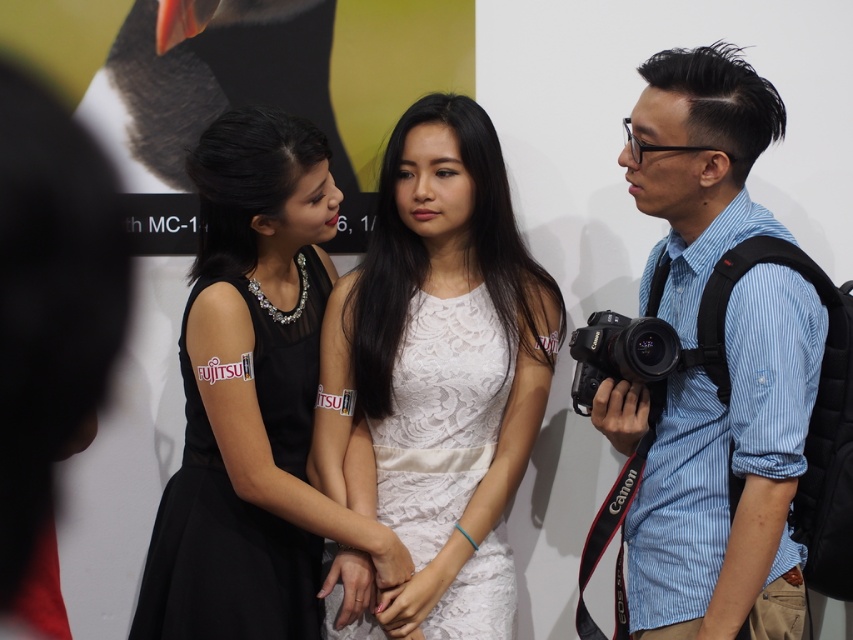
Question: Which point is closer to the camera taking this photo?

Choices:
 (A) (601, 324)
 (B) (476, 620)

Answer: (A)

Question: Estimate the real-world distances between objects in this image. Which object is closer to the blue striped shirt at right?

Choices:
 (A) black plastic camera at right
 (B) black lace dress at center
 (C) white lace dress at center

Answer: (A)

Question: Which of the following is the farthest from the observer?

Choices:
 (A) black plastic camera at right
 (B) black lace dress at center

Answer: (B)

Question: Is white lace dress at center bigger than black plastic camera at right?

Choices:
 (A) no
 (B) yes

Answer: (B)

Question: Where is white lace dress at center located in relation to black plastic camera at right in the image?

Choices:
 (A) above
 (B) below

Answer: (B)

Question: Is blue striped shirt at right smaller than black lace dress at center?

Choices:
 (A) yes
 (B) no

Answer: (B)